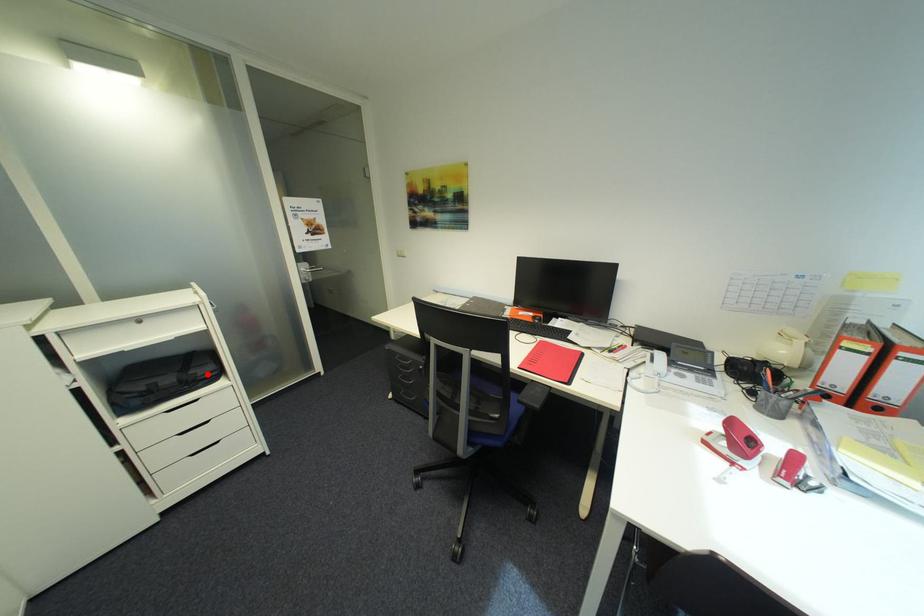
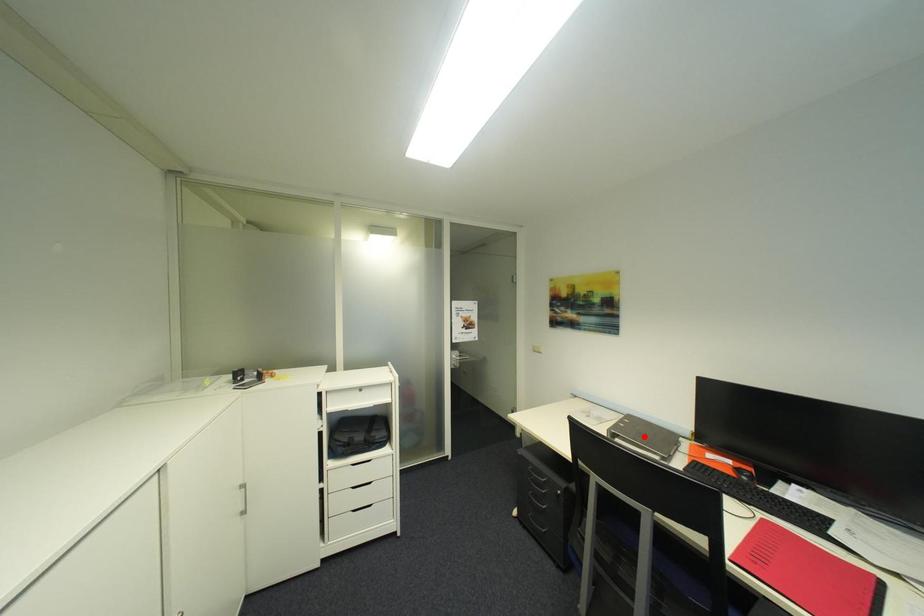
I am providing you with two images of the same scene from different viewpoints. A red point is marked on the first image and another point is marked on the second image. Do the highlighted points in image1 and image2 indicate the same real-world spot?

No